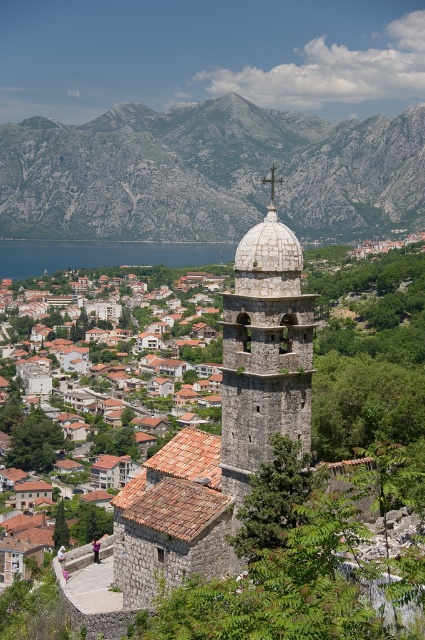
Question: Which of the following is the farthest from the observer?

Choices:
 (A) (180, 451)
 (B) (235, 259)
 (C) (418, 193)
 (D) (269, 269)

Answer: (C)

Question: Can you confirm if gray rocky mountain at upper center is positioned to the right of blue water at lower left?

Choices:
 (A) no
 (B) yes

Answer: (B)

Question: Which point is farther to the camera?

Choices:
 (A) (289, 240)
 (B) (365, 129)
 (C) (260, 326)
 (D) (206, 486)

Answer: (B)

Question: Observing the image, what is the correct spatial positioning of stone dome at center in reference to white stone dome at center?

Choices:
 (A) above
 (B) below

Answer: (B)

Question: Which point is closer to the camera?

Choices:
 (A) click(x=280, y=244)
 (B) click(x=0, y=241)
 (C) click(x=203, y=481)

Answer: (A)

Question: Is blue water at lower left thinner than white stone dome at center?

Choices:
 (A) yes
 (B) no

Answer: (B)